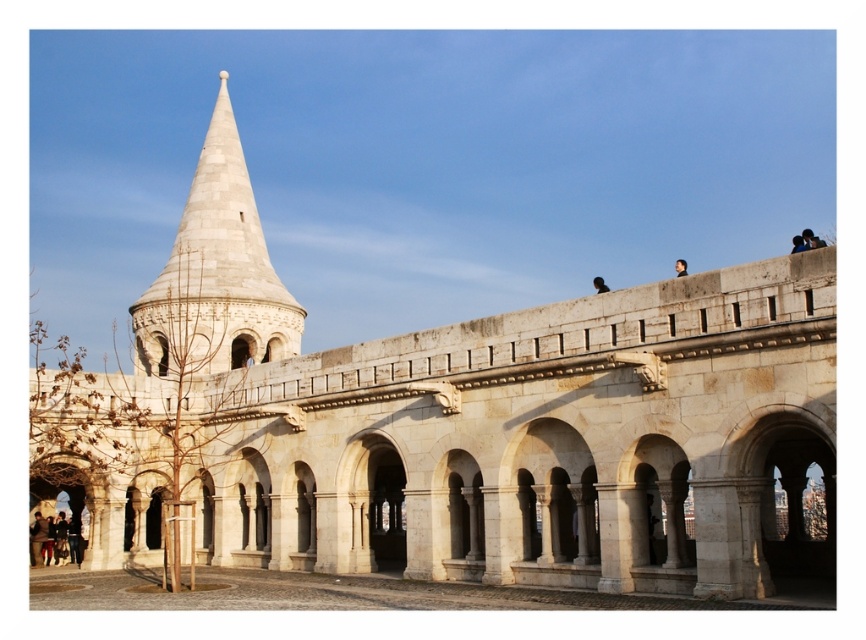
How distant is black matte person at upper right from brown leather jacket at upper center?

They are 56.01 feet apart.

Is point (603, 291) in front of point (680, 260)?

That is True.

You are a GUI agent. You are given a task and a screenshot of the screen. Output one action in this format:
    pyautogui.click(x=<x>, y=<y>)
    Task: Click on the black matte person at upper right
    The height and width of the screenshot is (640, 866).
    Given the screenshot: What is the action you would take?
    pyautogui.click(x=599, y=284)

Between point (197, 356) and point (596, 288), which one is positioned behind?

Positioned behind is point (596, 288).

Who is more forward, (191, 346) or (600, 276)?

Positioned in front is point (191, 346).

Is point (165, 348) farther from camera compared to point (593, 288)?

No.

Locate an element on the screen. white stone tower at upper left is located at coordinates (216, 273).

Can you confirm if white stone tower at upper left is taller than brown leather jacket at upper center?

Yes.

Which is behind, point (237, 259) or point (683, 268)?

The point (237, 259) is more distant.

The image size is (866, 640). I want to click on white stone tower at upper left, so click(216, 273).